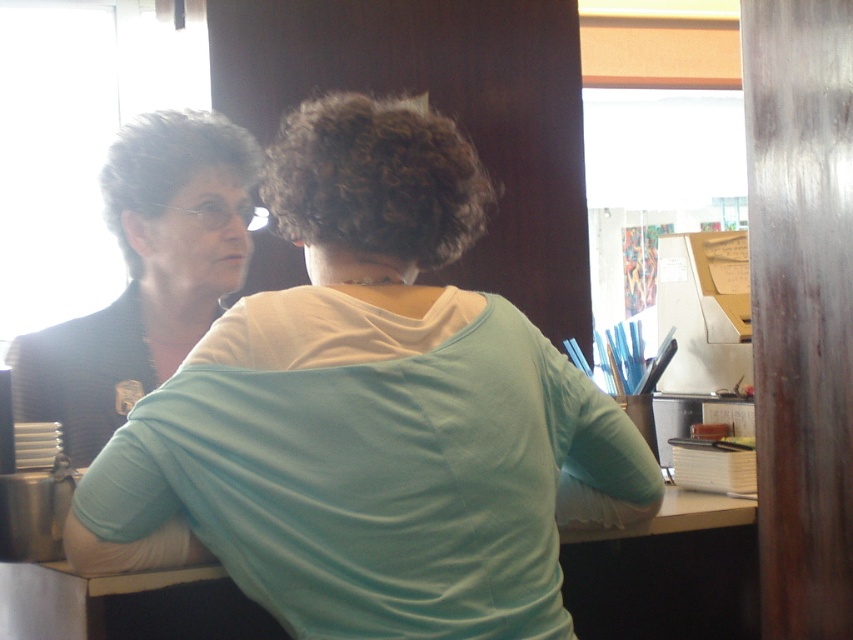
You are organizing a clothing rack and need to place the matte white shirt at upper left and the matte black jacket at left. According to the scene, which clothing item is positioned lower on the rack?

The matte white shirt at upper left is below the matte black jacket at left, so the matte white shirt at upper left is positioned lower on the rack.

You are organizing a clothing donation drive and need to determine which item takes up more space. Based on the image, which of the two items, the matte white shirt at upper left or the matte black jacket at left, is larger in size?

The matte white shirt at upper left is bigger than the matte black jacket at left, so it takes up more space and should be considered the larger item for donation purposes.

You are standing in the office scene described. The camera is positioned to capture the scene as shown. If you were to draw a straight line from the camera to the matte white shirt at upper left, which direction would this line point relative to the wooden partition on the right side?

The line from the camera to the matte white shirt at upper left would point towards the upper left direction relative to the wooden partition on the right side since the shirt is positioned at coordinates (370, 412).